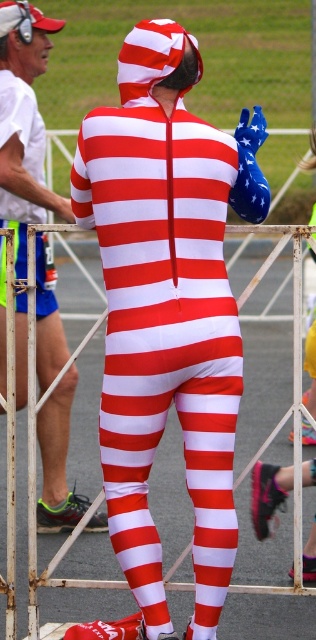
You are a photographer trying to capture a clear shot of the matte red and white striped suit at center and the smooth asphalt race track at center. Which object is positioned closer to your camera lens?

The matte red and white striped suit at center is closer to the viewer than the smooth asphalt race track at center, so the photographer should focus on the matte red and white striped suit at center to ensure it appears sharp in the photo.